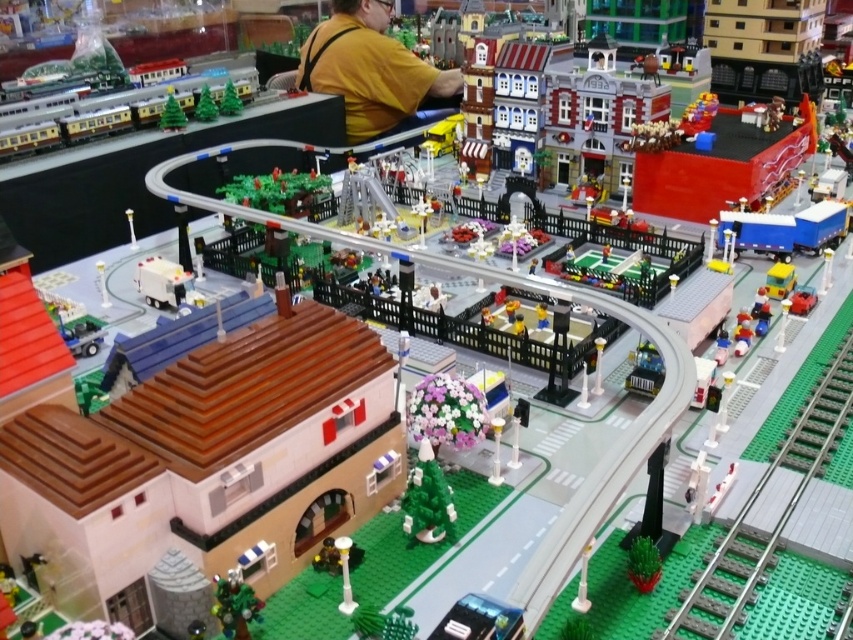
Does pastel floral bouquet at center have a lesser width compared to white matte van at lower left?

Correct, pastel floral bouquet at center's width is less than white matte van at lower left's.

What do you see at coordinates (445, 412) in the screenshot? I see `pastel floral bouquet at center` at bounding box center [445, 412].

I want to click on pastel floral bouquet at center, so click(445, 412).

At what (x,y) coordinates should I click in order to perform the action: click on pastel floral bouquet at center. Please return your answer as a coordinate pair (x, y). Looking at the image, I should click on (445, 412).

What do you see at coordinates (753, 502) in the screenshot? I see `green plastic train track at lower right` at bounding box center [753, 502].

Who is positioned more to the left, green plastic train track at lower right or green matte christmas tree at center?

green matte christmas tree at center is more to the left.

Who is more distant from viewer, (820, 435) or (454, 525)?

The point (820, 435) is more distant.

Where is `green plastic train track at lower right`? This screenshot has width=853, height=640. green plastic train track at lower right is located at coordinates (753, 502).

Locate an element on the screen. green plastic train track at lower right is located at coordinates (753, 502).

This screenshot has width=853, height=640. I want to click on green plastic train track at lower right, so click(753, 502).